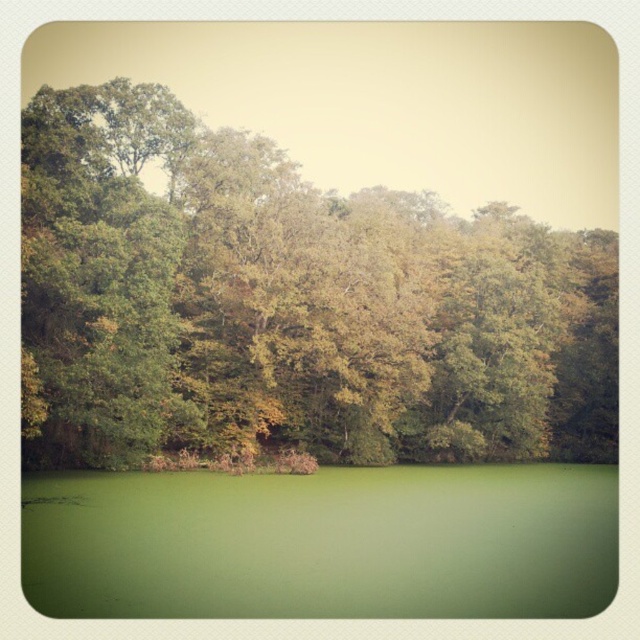
What do you see at coordinates (289, 305) in the screenshot?
I see `green leafy trees at upper center` at bounding box center [289, 305].

Can you confirm if green leafy trees at upper center is positioned above green matte water at bottom?

Yes.

I want to click on green leafy trees at upper center, so click(289, 305).

Identify the location of green leafy trees at upper center. The width and height of the screenshot is (640, 640). pos(289,305).